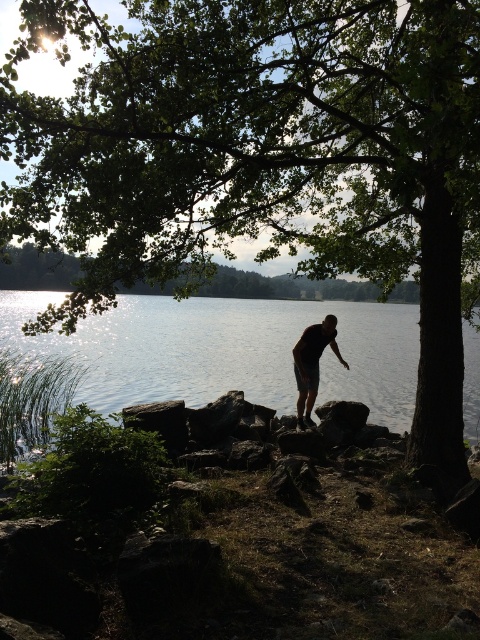
Does glistening water at center have a lesser width compared to dark skin/shorts at center?

In fact, glistening water at center might be wider than dark skin/shorts at center.

Does point (465, 410) come in front of point (316, 352)?

That is False.

Which is behind, point (379, 396) or point (317, 385)?

The point (379, 396) is behind.

I want to click on glistening water at center, so click(x=227, y=349).